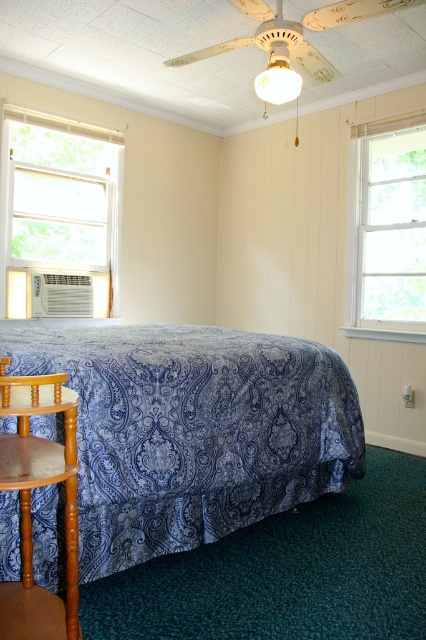
Does point (140, 561) lie in front of point (279, 96)?

Yes, point (140, 561) is in front of point (279, 96).

Between point (299, 438) and point (282, 84), which one is positioned behind?

The point (282, 84) is more distant.

Find the location of `blue paisley fabric bedspread at center`. blue paisley fabric bedspread at center is located at coordinates (192, 429).

Is point (302, 412) behind point (42, 257)?

That is False.

Is blue paisley fabric bedspread at center positioned in front of white fabric window at left?

Yes.

Is point (230, 340) positioned after point (97, 202)?

That is False.

Identify the location of blue paisley fabric bedspread at center. (192, 429).

Can you confirm if white fabric window at left is positioned to the left of wooden armchair at lower left?

Correct, you'll find white fabric window at left to the left of wooden armchair at lower left.

Between point (78, 129) and point (34, 378), which one is positioned behind?

Point (78, 129)

What do you see at coordinates (58, 212) in the screenshot?
I see `white fabric window at left` at bounding box center [58, 212].

Where is `white fabric window at left`? white fabric window at left is located at coordinates (58, 212).